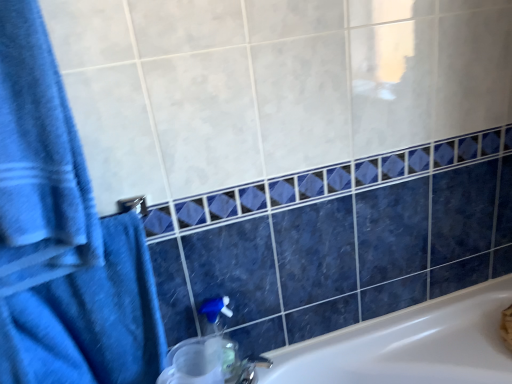
Question: Does blue cotton towel at left, the 2th bath towel in the bottom-to-top sequence, have a greater height compared to blue fabric towel at left, which is counted as the 2th bath towel, starting from the top?

Choices:
 (A) yes
 (B) no

Answer: (A)

Question: From a real-world perspective, is blue cotton towel at left, the 1th bath towel in the top-to-bottom sequence, under blue fabric towel at left, arranged as the first bath towel when ordered from the bottom?

Choices:
 (A) no
 (B) yes

Answer: (A)

Question: Is blue fabric towel at left, which is counted as the 2th bath towel, starting from the top, a part of blue cotton towel at left, the 1th bath towel in the top-to-bottom sequence?

Choices:
 (A) no
 (B) yes

Answer: (A)

Question: Is blue fabric towel at left, arranged as the first bath towel when ordered from the bottom, at the back of blue cotton towel at left, the 2th bath towel in the bottom-to-top sequence?

Choices:
 (A) no
 (B) yes

Answer: (A)

Question: Does blue cotton towel at left, the 1th bath towel in the top-to-bottom sequence, have a larger size compared to blue fabric towel at left, which is counted as the 2th bath towel, starting from the top?

Choices:
 (A) yes
 (B) no

Answer: (B)

Question: Does point (208, 307) appear closer or farther from the camera than point (155, 322)?

Choices:
 (A) farther
 (B) closer

Answer: (A)

Question: Is translucent plastic soap dispenser at lower center in front of or behind blue fabric towel at left, arranged as the first bath towel when ordered from the bottom, in the image?

Choices:
 (A) behind
 (B) front

Answer: (A)

Question: In terms of size, does translucent plastic soap dispenser at lower center appear bigger or smaller than blue fabric towel at left, arranged as the first bath towel when ordered from the bottom?

Choices:
 (A) small
 (B) big

Answer: (A)

Question: From the image's perspective, relative to blue fabric towel at left, which is counted as the 2th bath towel, starting from the top, is translucent plastic soap dispenser at lower center above or below?

Choices:
 (A) above
 (B) below

Answer: (B)

Question: Based on their positions, is blue fabric towel at left, arranged as the first bath towel when ordered from the bottom, located to the left or right of translucent plastic soap dispenser at lower center?

Choices:
 (A) right
 (B) left

Answer: (B)

Question: In terms of width, does blue fabric towel at left, which is counted as the 2th bath towel, starting from the top, look wider or thinner when compared to translucent plastic soap dispenser at lower center?

Choices:
 (A) thin
 (B) wide

Answer: (B)

Question: Considering their positions, is blue fabric towel at left, arranged as the first bath towel when ordered from the bottom, located in front of or behind translucent plastic soap dispenser at lower center?

Choices:
 (A) behind
 (B) front

Answer: (B)

Question: Is blue fabric towel at left, arranged as the first bath towel when ordered from the bottom, bigger or smaller than translucent plastic soap dispenser at lower center?

Choices:
 (A) big
 (B) small

Answer: (A)

Question: Looking at the image, does blue fabric towel at left, arranged as the first bath towel when ordered from the bottom, seem bigger or smaller compared to blue cotton towel at left, the 1th bath towel in the top-to-bottom sequence?

Choices:
 (A) small
 (B) big

Answer: (B)

Question: Is blue fabric towel at left, arranged as the first bath towel when ordered from the bottom, wider or thinner than blue cotton towel at left, the 2th bath towel in the bottom-to-top sequence?

Choices:
 (A) thin
 (B) wide

Answer: (B)